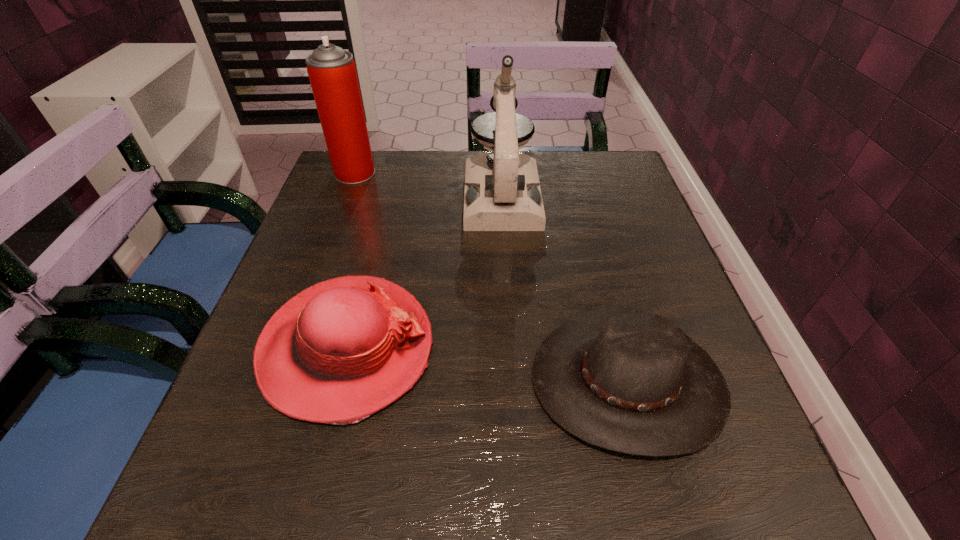
Where is `aerosol can`? aerosol can is located at coordinates (332, 73).

Where is `microscope`? The width and height of the screenshot is (960, 540). microscope is located at coordinates (502, 192).

This screenshot has height=540, width=960. I want to click on the left hat, so click(x=339, y=351).

Where is `the right hat`? the right hat is located at coordinates (625, 380).

Where is `blank space located on the right of the aerosol can`? blank space located on the right of the aerosol can is located at coordinates (417, 173).

Where is `blank space located at the eyepiece of the microscope`? The width and height of the screenshot is (960, 540). blank space located at the eyepiece of the microscope is located at coordinates (513, 373).

At what (x,y) coordinates should I click in order to perform the action: click on free spot located 0.080m at the front of the left hat with a bow. Please return your answer as a coordinate pair (x, y). The height and width of the screenshot is (540, 960). Looking at the image, I should click on coord(480,348).

I want to click on aerosol can at the far edge, so click(x=332, y=73).

At what (x,y) coordinates should I click in order to perform the action: click on microscope at the far edge. Please return your answer as a coordinate pair (x, y). This screenshot has height=540, width=960. Looking at the image, I should click on (502, 192).

Locate an element on the screen. The height and width of the screenshot is (540, 960). object that is at the near edge is located at coordinates click(x=625, y=380).